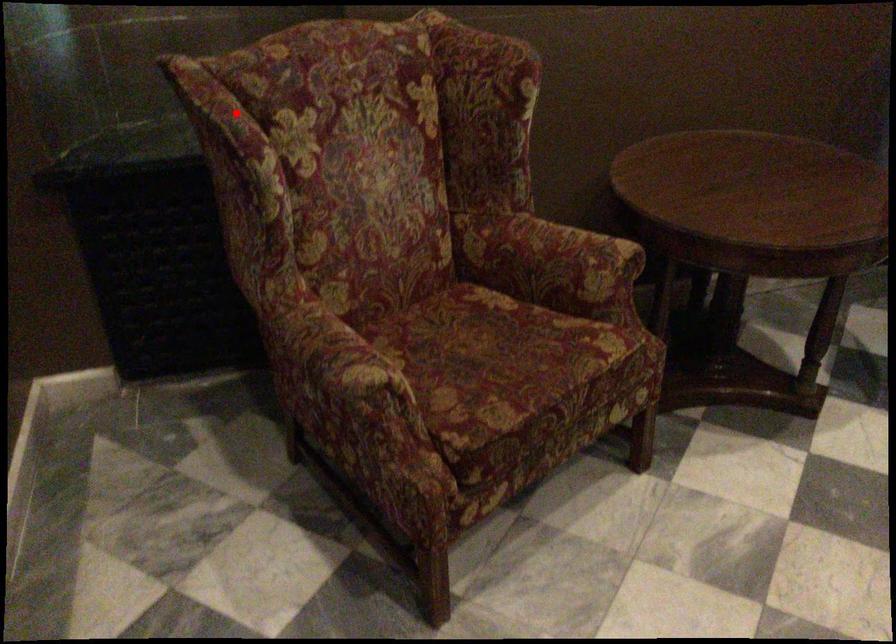
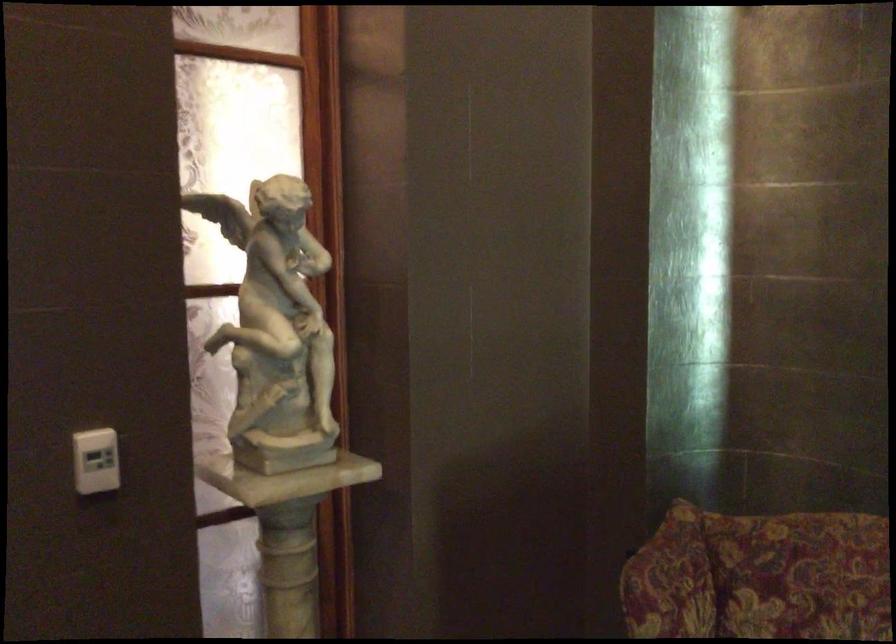
Where in the second image is the point corresponding to the highlighted location from the first image?

(670, 581)